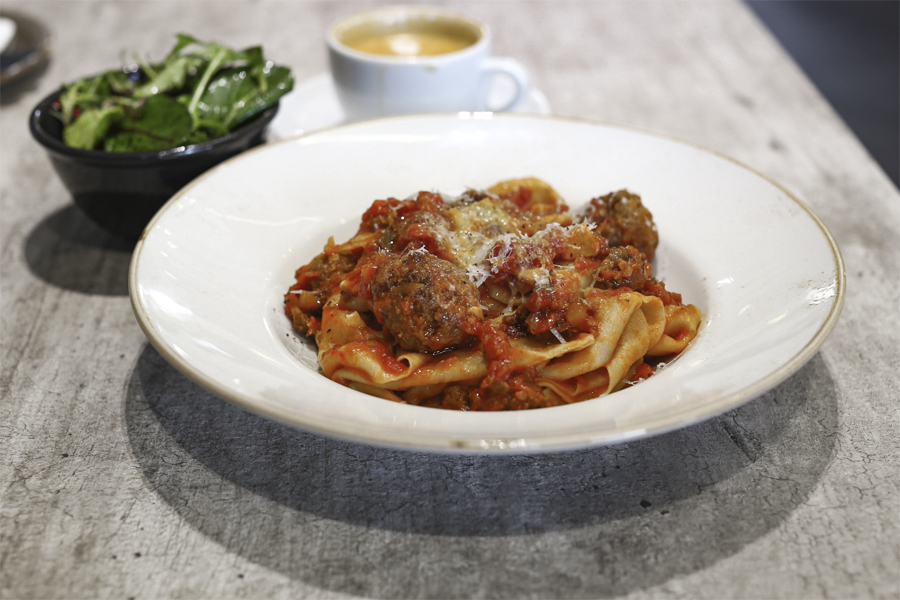
At what (x,y) coordinates should I click in order to perform the action: click on bowl. Please return your answer as a coordinate pair (x, y). This screenshot has width=900, height=600. Looking at the image, I should click on (103, 193).